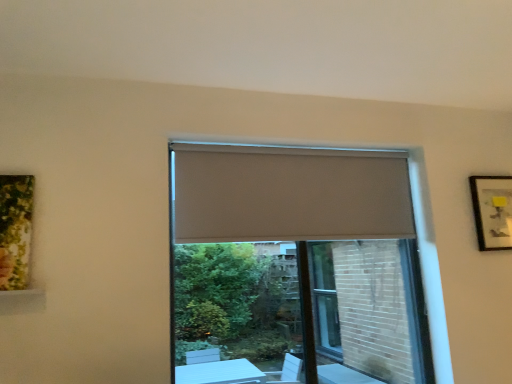
Question: From a real-world perspective, is matte gray screen door at center located higher than beige fabric curtain at center?

Choices:
 (A) yes
 (B) no

Answer: (B)

Question: From the image's perspective, is matte gray screen door at center over beige fabric curtain at center?

Choices:
 (A) no
 (B) yes

Answer: (A)

Question: Is beige fabric curtain at center at the back of matte gray screen door at center?

Choices:
 (A) no
 (B) yes

Answer: (B)

Question: Would you say matte gray screen door at center is outside beige fabric curtain at center?

Choices:
 (A) yes
 (B) no

Answer: (A)

Question: Is matte gray screen door at center positioned behind beige fabric curtain at center?

Choices:
 (A) no
 (B) yes

Answer: (B)

Question: Is matte black picture frame at upper right bigger or smaller than beige fabric curtain at center?

Choices:
 (A) small
 (B) big

Answer: (A)

Question: Is matte black picture frame at upper right inside the boundaries of beige fabric curtain at center, or outside?

Choices:
 (A) inside
 (B) outside

Answer: (B)

Question: Considering the positions of point (498, 180) and point (333, 185), is point (498, 180) closer or farther from the camera than point (333, 185)?

Choices:
 (A) closer
 (B) farther

Answer: (B)

Question: In the image, is matte black picture frame at upper right positioned in front of or behind beige fabric curtain at center?

Choices:
 (A) front
 (B) behind

Answer: (B)

Question: From their relative heights in the image, would you say matte gray screen door at center is taller or shorter than matte black picture frame at upper right?

Choices:
 (A) short
 (B) tall

Answer: (B)

Question: Is matte gray screen door at center spatially inside matte black picture frame at upper right, or outside of it?

Choices:
 (A) outside
 (B) inside

Answer: (A)

Question: From the image's perspective, is matte gray screen door at center located above or below matte black picture frame at upper right?

Choices:
 (A) above
 (B) below

Answer: (B)

Question: Is matte gray screen door at center in front of or behind matte black picture frame at upper right in the image?

Choices:
 (A) front
 (B) behind

Answer: (A)

Question: Is matte gray screen door at center in front of or behind beige fabric curtain at center in the image?

Choices:
 (A) front
 (B) behind

Answer: (B)

Question: Would you say matte gray screen door at center is inside or outside beige fabric curtain at center?

Choices:
 (A) outside
 (B) inside

Answer: (A)